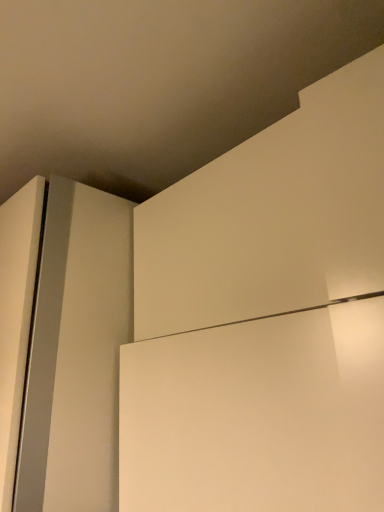
What do you see at coordinates (77, 353) in the screenshot?
I see `white matte door at left` at bounding box center [77, 353].

What is the approximate height of white matte door at left?

white matte door at left is 3.56 feet in height.

Find the location of a particular element. The height and width of the screenshot is (512, 384). white matte door at left is located at coordinates (77, 353).

Image resolution: width=384 pixels, height=512 pixels. I want to click on white matte door at left, so click(x=77, y=353).